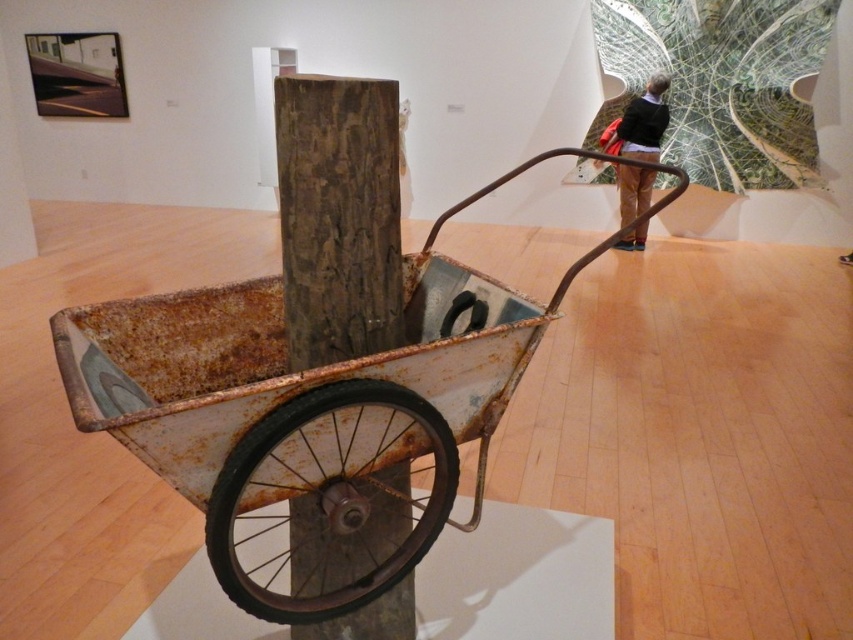
Who is lower down, rusty metal cart at center or rusty metal wheel at center?

rusty metal wheel at center is below.

Is point (474, 196) farther from camera compared to point (219, 556)?

Yes, it is.

In order to click on rusty metal cart at center in this screenshot , I will do `click(300, 406)`.